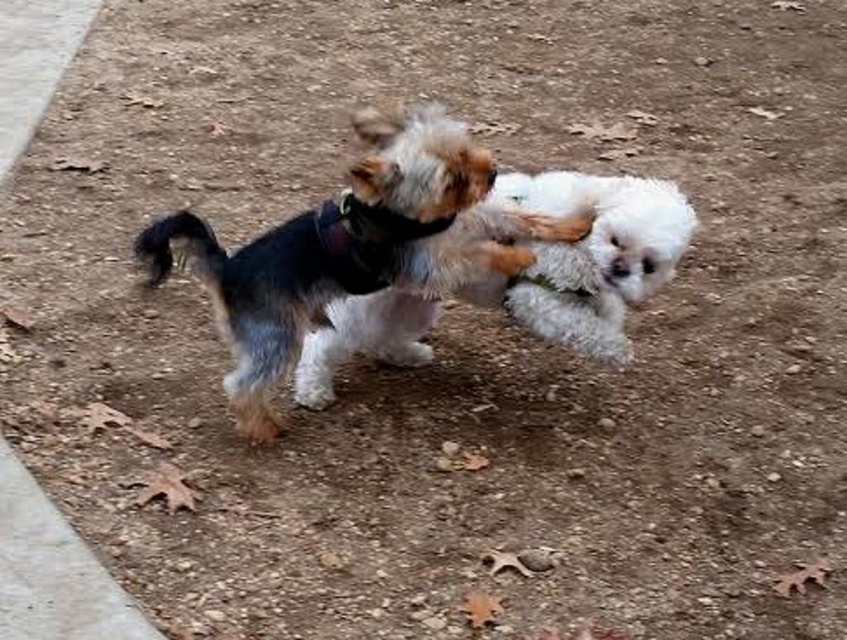
Question: Does soft fur dog at center appear on the left side of fluffy white dog at center?

Choices:
 (A) no
 (B) yes

Answer: (B)

Question: Is soft fur dog at center positioned at the back of fluffy white dog at center?

Choices:
 (A) yes
 (B) no

Answer: (B)

Question: Is soft fur dog at center further to camera compared to fluffy white dog at center?

Choices:
 (A) yes
 (B) no

Answer: (B)

Question: Which point appears closest to the camera in this image?

Choices:
 (A) (522, 250)
 (B) (609, 285)

Answer: (A)